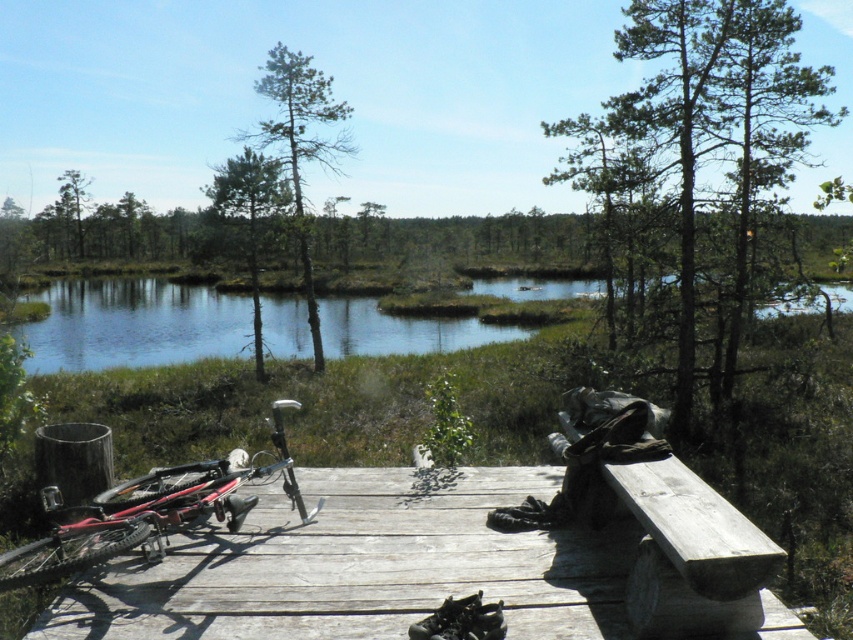
Question: Which point is farther to the camera?

Choices:
 (A) (733, 522)
 (B) (213, 509)
 (C) (529, 596)

Answer: (B)

Question: Can you confirm if wooden dock at lower left is thinner than weathered wood bench at lower right?

Choices:
 (A) no
 (B) yes

Answer: (A)

Question: Estimate the real-world distances between objects in this image. Which object is closer to the weathered wood bench at lower right?

Choices:
 (A) red matte mountain bike at lower left
 (B) wooden dock at lower left

Answer: (B)

Question: In this image, where is wooden dock at lower left located relative to weathered wood bench at lower right?

Choices:
 (A) below
 (B) above

Answer: (A)

Question: Does red matte mountain bike at lower left appear on the left side of weathered wood bench at lower right?

Choices:
 (A) yes
 (B) no

Answer: (A)

Question: Which object is closer to the camera taking this photo?

Choices:
 (A) red matte mountain bike at lower left
 (B) wooden dock at lower left
 (C) weathered wood bench at lower right

Answer: (C)